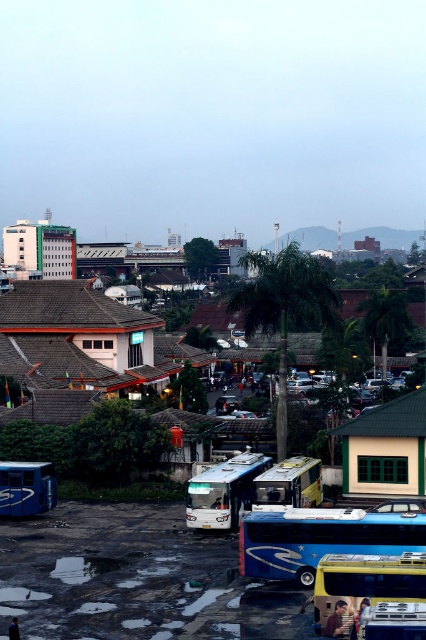
Question: In this image, where is beige matte building at center located relative to metallic silver bus at center?

Choices:
 (A) above
 (B) below

Answer: (A)

Question: Is beige matte building at center closer to the viewer compared to metallic silver bus at center?

Choices:
 (A) no
 (B) yes

Answer: (A)

Question: Which object appears closest to the camera in this image?

Choices:
 (A) white matte bus at center
 (B) metallic blue bus at lower left
 (C) blue metallic bus at lower center
 (D) yellow metallic bus at lower right

Answer: (D)

Question: Considering the real-world distances, which object is closest to the beige matte building at center?

Choices:
 (A) metallic blue bus at lower left
 (B) yellow metallic bus at lower right
 (C) metallic silver bus at center
 (D) white matte bus at center

Answer: (C)

Question: Based on their relative distances, which object is farther from the yellow metallic bus at lower right?

Choices:
 (A) white matte bus at center
 (B) beige matte building at center
 (C) metallic blue bus at lower left
 (D) blue metallic bus at lower center

Answer: (C)

Question: Can you confirm if yellow metallic bus at lower right is bigger than metallic blue bus at lower left?

Choices:
 (A) no
 (B) yes

Answer: (B)